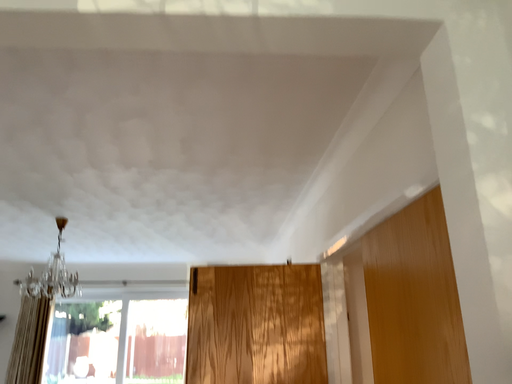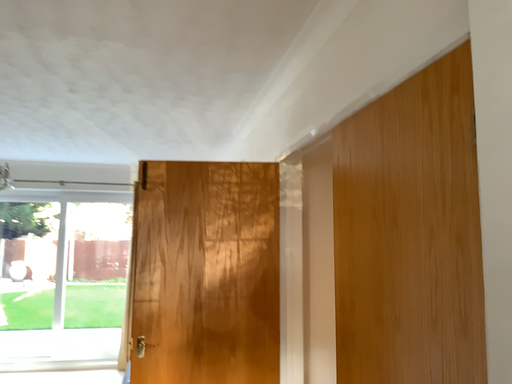
Question: Which way did the camera rotate in the video?

Choices:
 (A) rotated right
 (B) rotated left

Answer: (A)